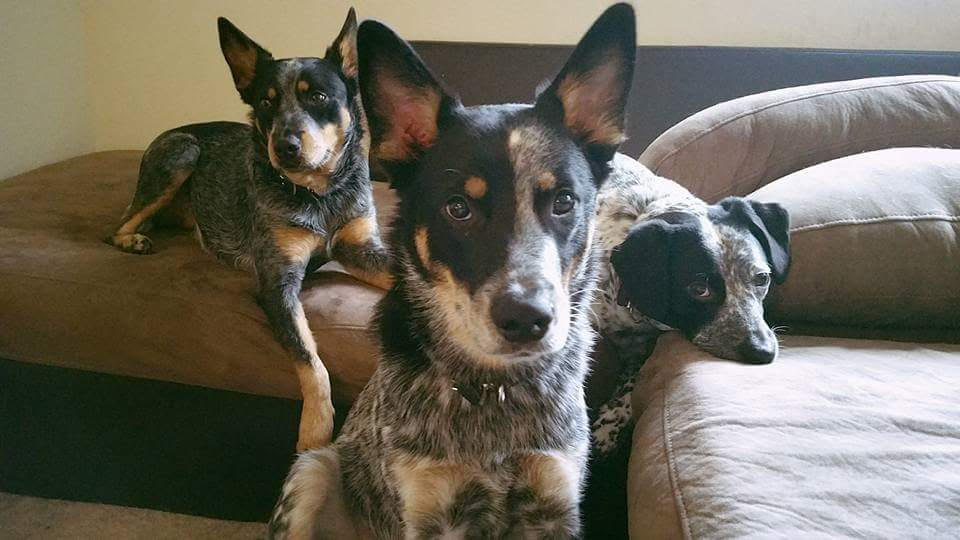
I want to click on rope and stitching on brown couch cushions, so click(674, 481).